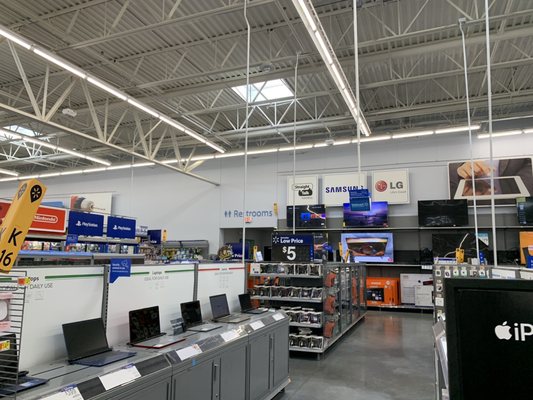
The image size is (533, 400). Identify the location of skylight. (273, 91).